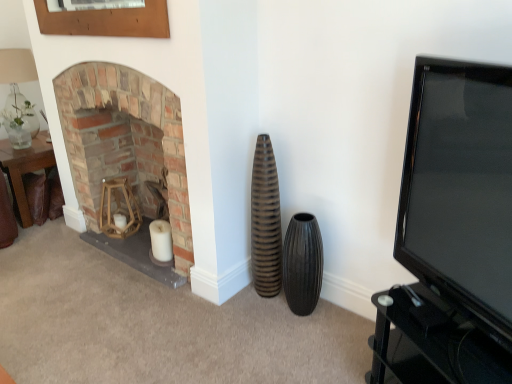
Question: Visually, is wooden frame at upper left positioned to the left or to the right of translucent glass vase at upper left?

Choices:
 (A) left
 (B) right

Answer: (B)

Question: Does point (84, 23) appear closer or farther from the camera than point (11, 71)?

Choices:
 (A) closer
 (B) farther

Answer: (A)

Question: Which of these objects is positioned closest to the wooden frame at upper left?

Choices:
 (A) brick fireplace at left
 (B) black glossy tv at right
 (C) brown ribbed vase at center, which is the 1th vase from left to right
 (D) brown leather table at left
 (E) translucent glass vase at upper left

Answer: (A)

Question: Which object is positioned farthest from the brown ribbed vase at center, which is the 1th vase from left to right?

Choices:
 (A) black glossy tv at right
 (B) wooden frame at upper left
 (C) brown leather table at left
 (D) black ribbed vase at center, the 1th vase in the right-to-left sequence
 (E) translucent glass vase at upper left

Answer: (E)